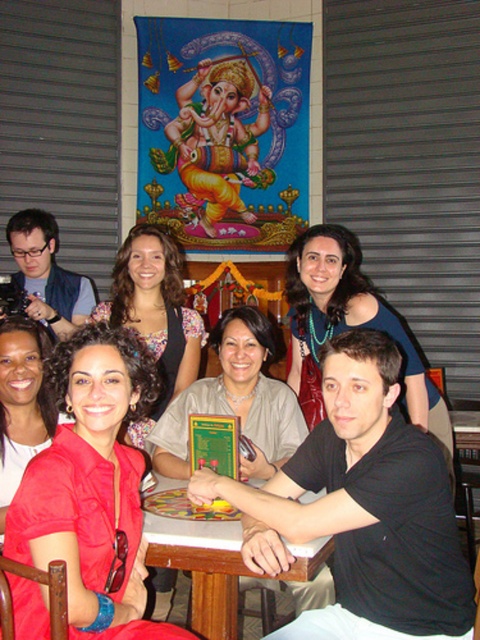
How far apart are matte beige blouse at center and floral blouse at center?

matte beige blouse at center and floral blouse at center are 20.92 inches apart from each other.

From the picture: Is matte beige blouse at center above floral blouse at center?

No.

Looking at this image, who is more forward, (303, 428) or (140, 259)?

Positioned in front is point (303, 428).

This screenshot has width=480, height=640. In order to click on matte beige blouse at center in this screenshot , I will do `click(235, 401)`.

Which is in front, point (98, 420) or point (179, 410)?

Point (98, 420)

Can you confirm if red satin dress at lower left is positioned to the right of matte beige blouse at center?

In fact, red satin dress at lower left is to the left of matte beige blouse at center.

Identify the location of red satin dress at lower left. The image size is (480, 640). (93, 486).

Can you confirm if black matte shirt at center is bigger than blue fabric dress at center?

Incorrect, black matte shirt at center is not larger than blue fabric dress at center.

Who is more distant from viewer, (336, 467) or (314, 360)?

Positioned behind is point (314, 360).

Where is `black matte shirt at center`? This screenshot has height=640, width=480. black matte shirt at center is located at coordinates (363, 502).